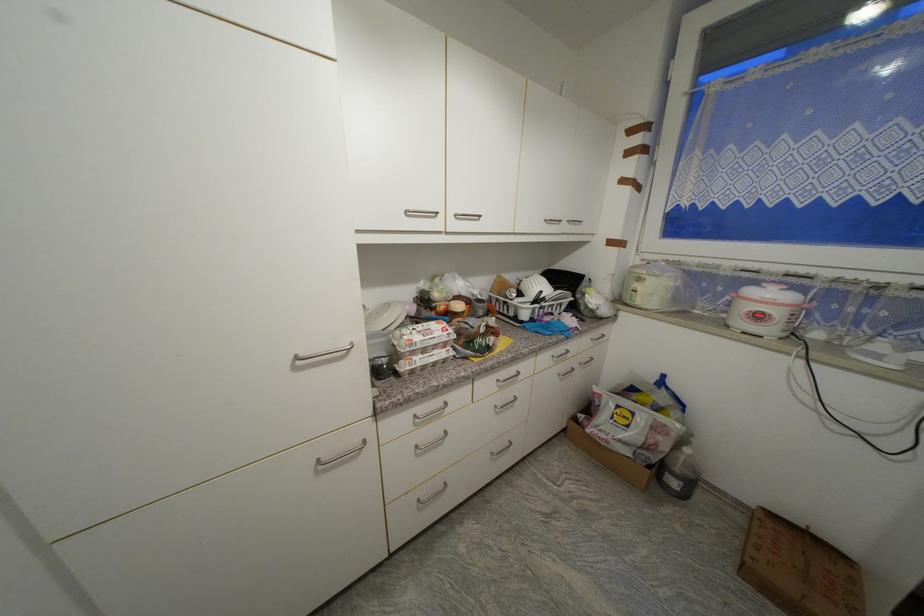
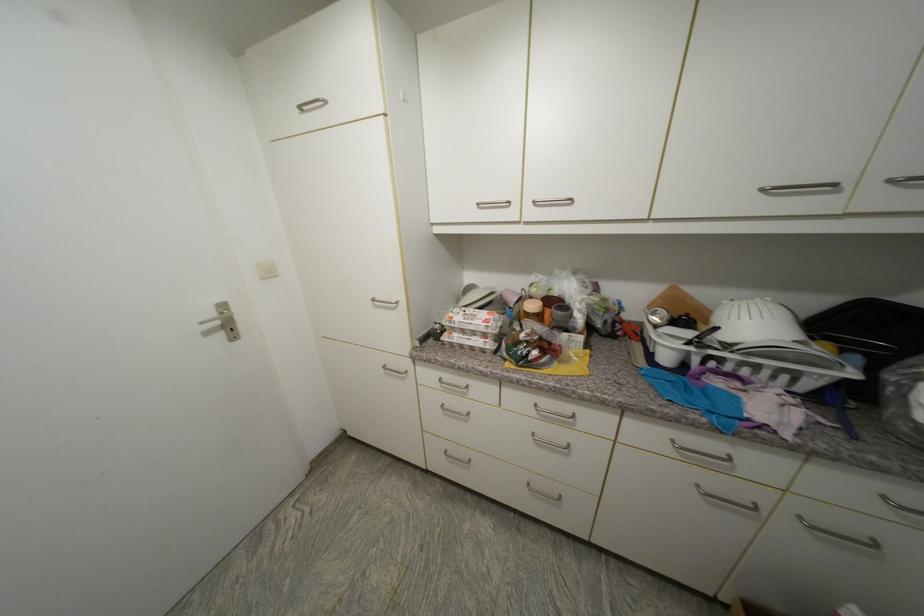
Where in the second image is the point corresponding to (558,358) from the first image?

(678, 443)